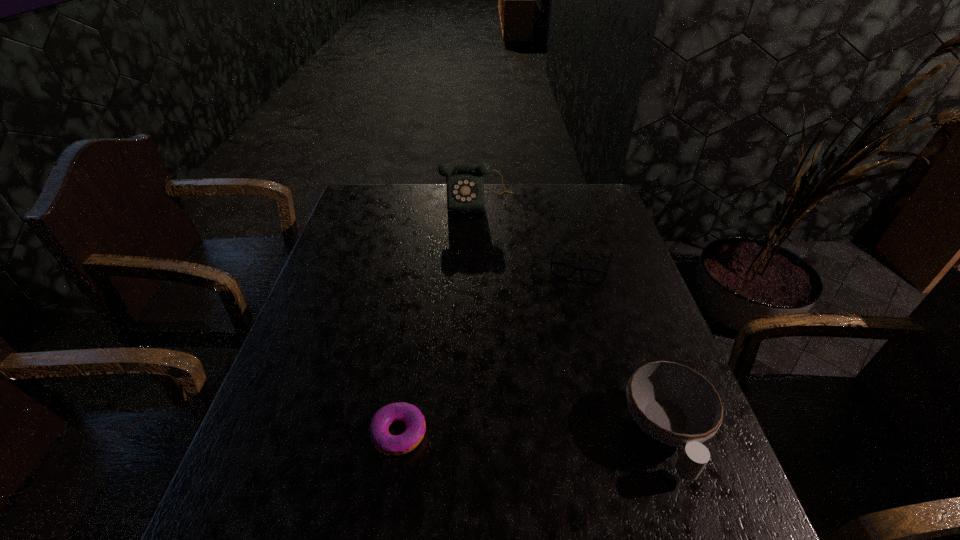
I want to click on vacant space on the desktop that is between the shortest object and the chinaware and is positioned on the front-facing side of the second shortest object, so click(x=540, y=433).

Where is `free space on the desktop that is between the doughnut and the chinaware and is positioned on the dial of the farthest object`? The width and height of the screenshot is (960, 540). free space on the desktop that is between the doughnut and the chinaware and is positioned on the dial of the farthest object is located at coordinates (506, 433).